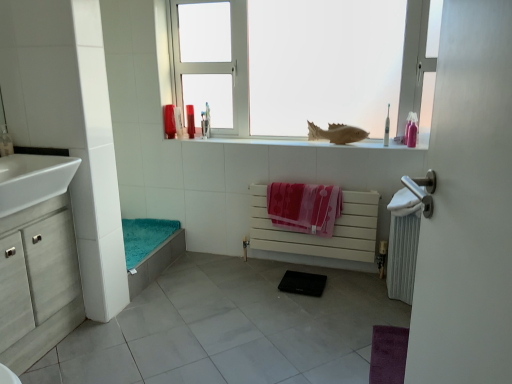
I want to click on space that is in front of white matte radiator at center, marked as the 2th radiator in a right-to-left arrangement, so click(x=311, y=309).